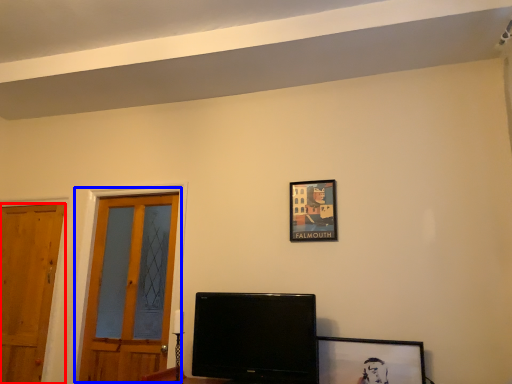
Question: Among these objects, which one is farthest to the camera, door (highlighted by a red box) or door (highlighted by a blue box)?

Choices:
 (A) door
 (B) door

Answer: (A)